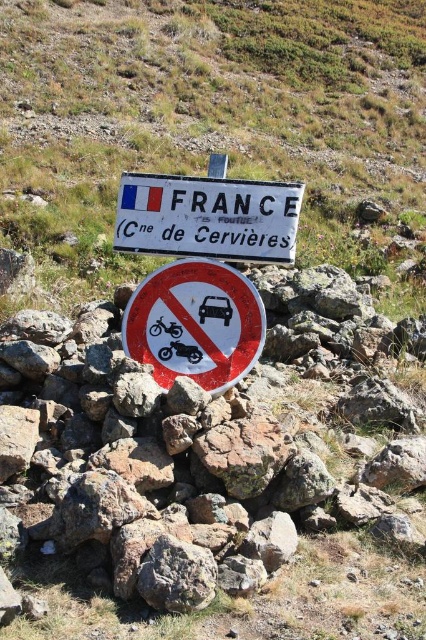
The width and height of the screenshot is (426, 640). Find the location of `white plastic sign at center`. white plastic sign at center is located at coordinates (203, 273).

What do you see at coordinates (203, 273) in the screenshot? This screenshot has width=426, height=640. I see `white plastic sign at center` at bounding box center [203, 273].

Identify the location of white plastic sign at center. (203, 273).

Is metallic reflective sign at center in front of white plastic sign at upper center?

Yes.

Can you confirm if metallic reflective sign at center is positioned to the left of white plastic sign at upper center?

Indeed, metallic reflective sign at center is positioned on the left side of white plastic sign at upper center.

This screenshot has height=640, width=426. What do you see at coordinates (195, 323) in the screenshot? I see `metallic reflective sign at center` at bounding box center [195, 323].

Find the location of `metallic reflective sign at center`. metallic reflective sign at center is located at coordinates (195, 323).

Who is positioned more to the left, brown rocky hillside at center or metallic reflective sign at center?

From the viewer's perspective, metallic reflective sign at center appears more on the left side.

Between point (80, 76) and point (184, 284), which one is positioned behind?

The point (80, 76) is more distant.

This screenshot has width=426, height=640. In order to click on brown rocky hillside at center in this screenshot , I will do `click(212, 118)`.